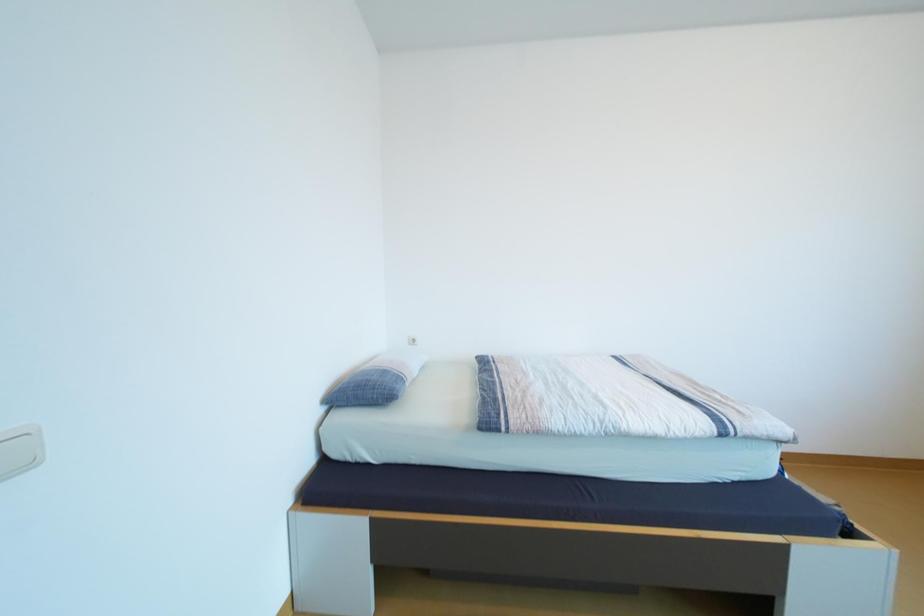
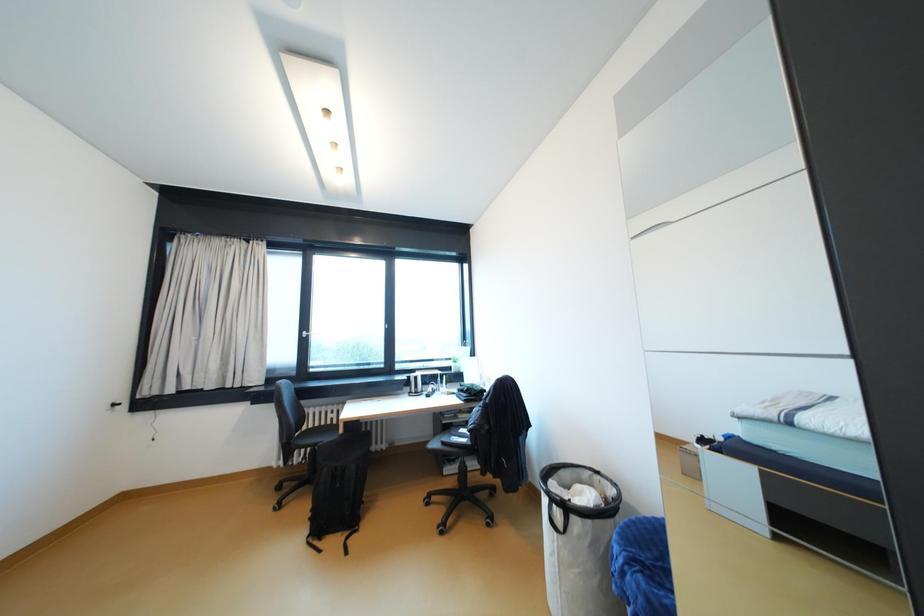
Question: How did the camera likely rotate?

Choices:
 (A) Left
 (B) Right
 (C) Up
 (D) Down

Answer: (B)